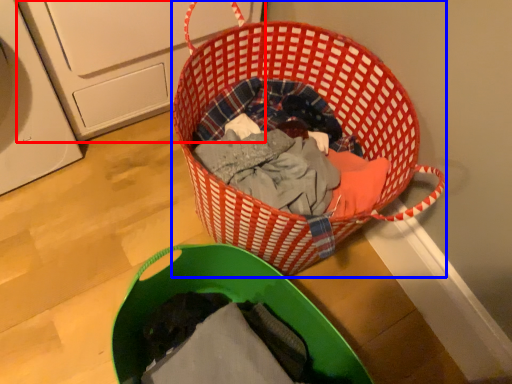
Question: Among these objects, which one is nearest to the camera, washing machine (highlighted by a red box) or picnic basket (highlighted by a blue box)?

Choices:
 (A) washing machine
 (B) picnic basket

Answer: (B)